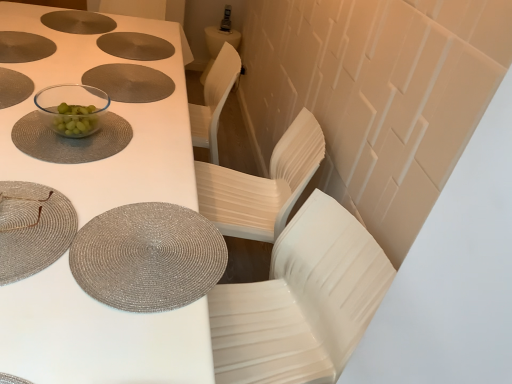
Locate an element on the screen. This screenshot has width=512, height=384. vacant space in between silver textured placemat at lower left, arranged as the fifth tableware when viewed from the top, and transparent glass bowl at center, placed as the fourth tableware when sorted from bottom to top is located at coordinates (116, 166).